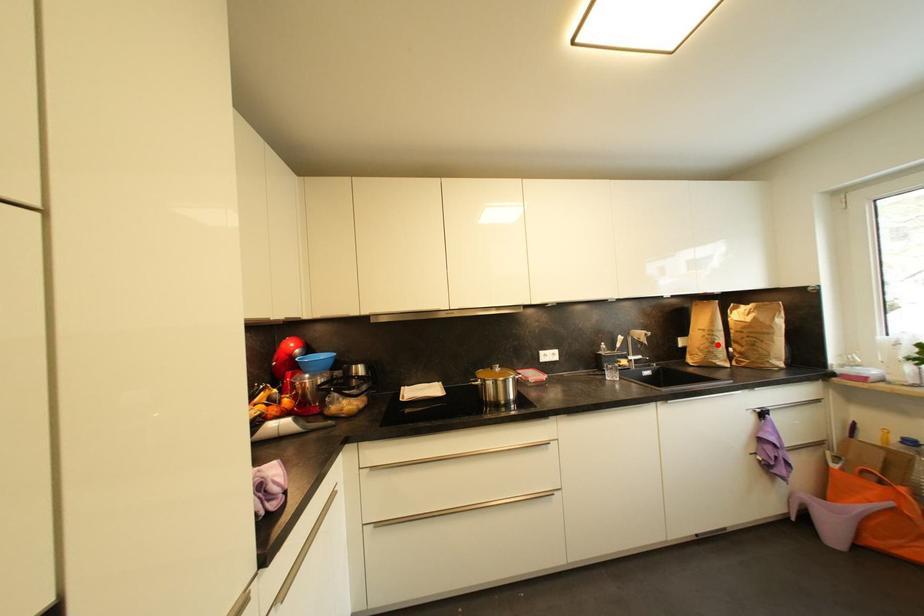
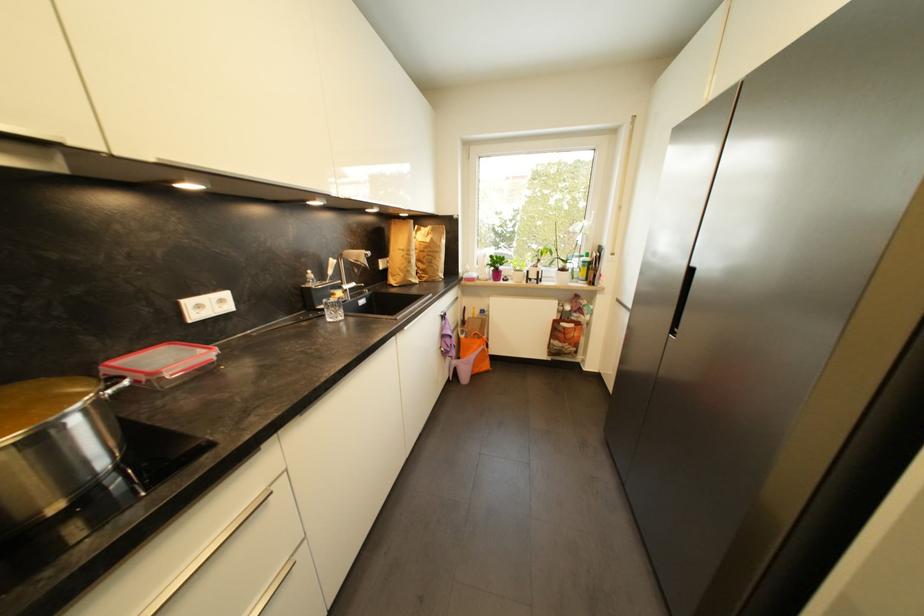
Question: I am providing you with two images of the same scene from different viewpoints. Image1 has a red point marked. In image2, the corresponding 3D location appears at what relative position? Reply with the corresponding letter.

Choices:
 (A) Closer
 (B) Farther

Answer: (A)